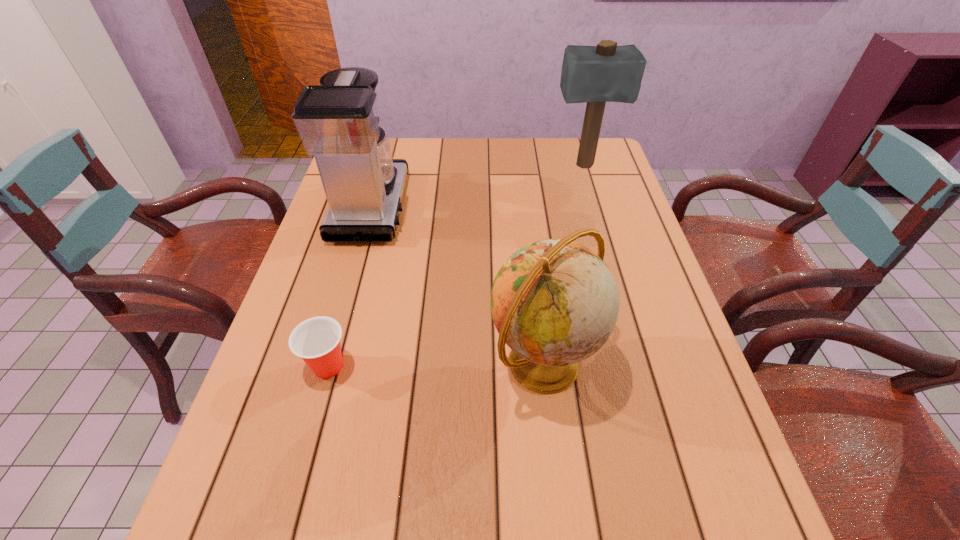
Where is `coffee maker that is at the left edge`? This screenshot has height=540, width=960. coffee maker that is at the left edge is located at coordinates (338, 123).

The width and height of the screenshot is (960, 540). Find the location of `cup located in the left edge section of the desktop`. cup located in the left edge section of the desktop is located at coordinates (316, 340).

You are a GUI agent. You are given a task and a screenshot of the screen. Output one action in this format:
    pyautogui.click(x=<x>, y=<y>)
    Task: Click on the object located in the right edge section of the desktop
    The width and height of the screenshot is (960, 540).
    Given the screenshot: What is the action you would take?
    pyautogui.click(x=604, y=73)

Where is `object that is at the far left corner`? object that is at the far left corner is located at coordinates (338, 123).

The image size is (960, 540). In order to click on object that is at the far right corner in this screenshot , I will do [604, 73].

In the image, there is a desktop. Identify the location of free region at the far edge. (539, 152).

Where is `vacant region at the near edge of the desktop`? vacant region at the near edge of the desktop is located at coordinates (371, 521).

I want to click on free space at the left edge of the desktop, so click(370, 252).

Where is `free space at the right edge of the desktop`? free space at the right edge of the desktop is located at coordinates (630, 317).

Find the location of `vacant space at the far right corner of the desktop`. vacant space at the far right corner of the desktop is located at coordinates pos(572,166).